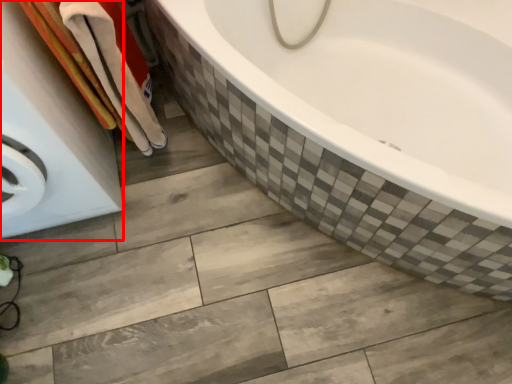
Question: From the image, what is the correct spatial relationship of washing machine (annotated by the red box) in relation to bath towel?

Choices:
 (A) left
 (B) right

Answer: (A)